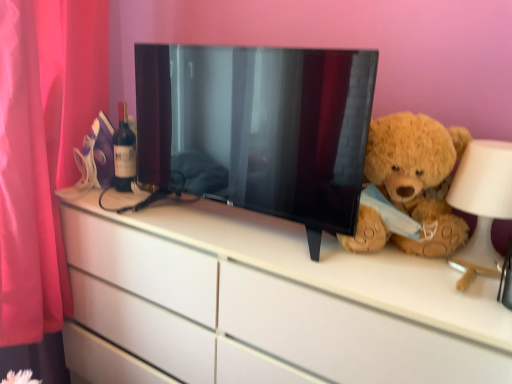
Find the location of a particular element. The image size is (512, 384). vacant area on top of white glossy chest of drawers at center (from a real-world perspective) is located at coordinates (261, 229).